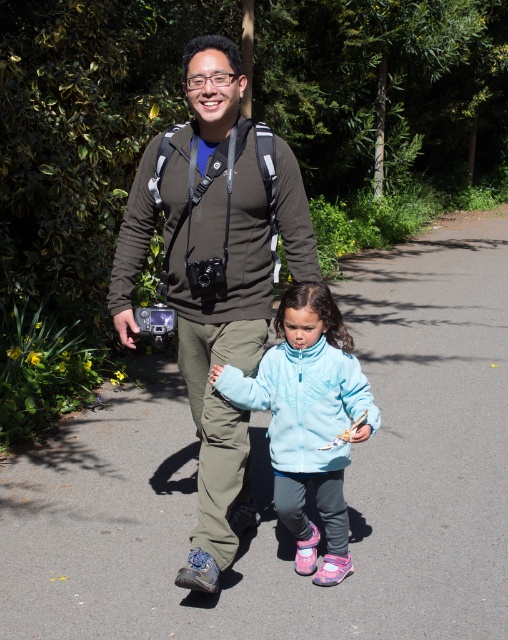
Is matte green jacket at center positioned before light blue fleece jacket at center?

No, it is behind light blue fleece jacket at center.

Which is above, matte green jacket at center or light blue fleece jacket at center?

matte green jacket at center is above.

Measure the distance between point (x=240, y=189) and camera.

They are 3.45 meters apart.

At what (x,y) coordinates should I click in order to perform the action: click on matte green jacket at center. Please return your answer as a coordinate pair (x, y). Image resolution: width=508 pixels, height=640 pixels. Looking at the image, I should click on (215, 275).

Between gray asphalt pavement at center and light blue fleece jacket at center, which one has less height?

With less height is light blue fleece jacket at center.

Does gray asphalt pavement at center have a smaller size compared to light blue fleece jacket at center?

No.

Locate an element on the screen. gray asphalt pavement at center is located at coordinates (271, 481).

The width and height of the screenshot is (508, 640). What are the coordinates of `gray asphalt pavement at center` in the screenshot? It's located at (271, 481).

Between point (177, 518) and point (141, 330), which one is positioned behind?

The point (177, 518) is more distant.

Find the location of a particular element. gray asphalt pavement at center is located at coordinates (271, 481).